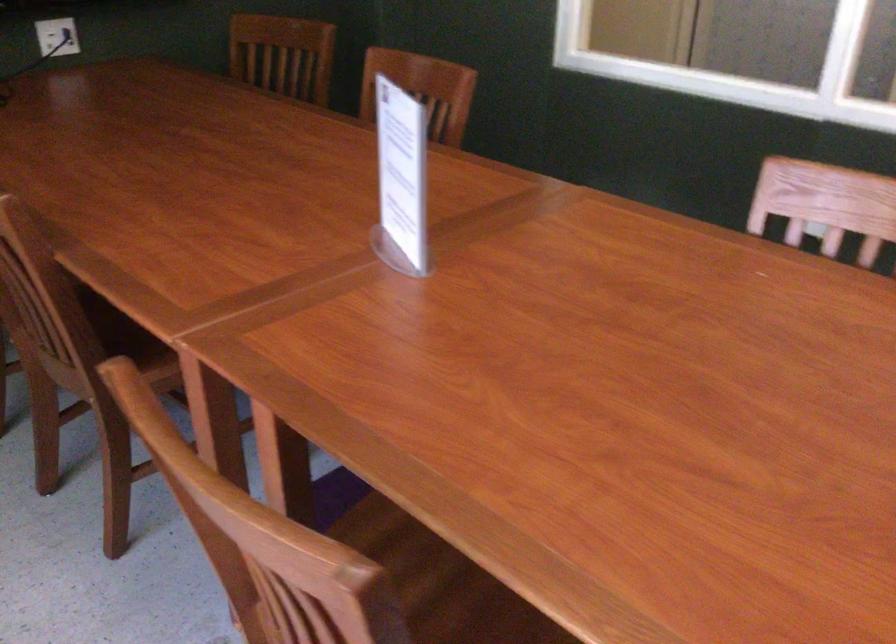
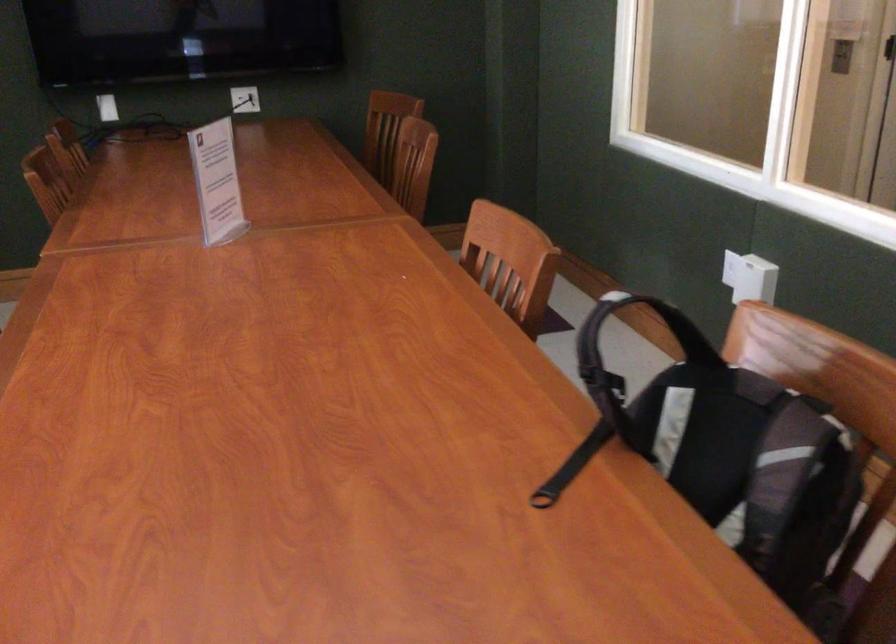
Question: Which direction would the cameraman need to move to produce the second image? Reply with the corresponding letter.

Choices:
 (A) Left
 (B) Right
 (C) Forward
 (D) Backward

Answer: (B)